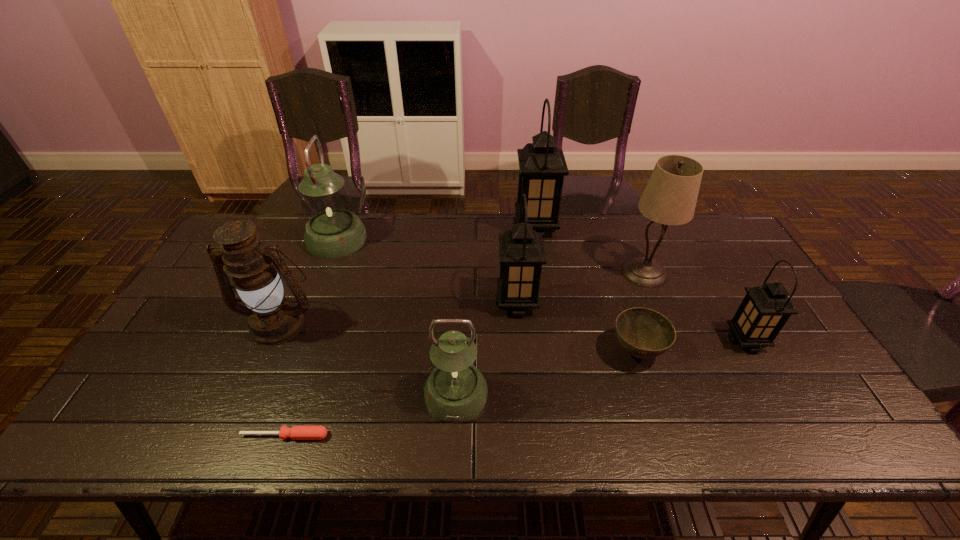
This screenshot has width=960, height=540. I want to click on free point between the second nearest lantern and the nearest object, so click(x=516, y=388).

Identify the location of vacant region between the lampshade and the fourth farthest lantern. The width and height of the screenshot is (960, 540). (695, 307).

You are a GUI agent. You are given a task and a screenshot of the screen. Output one action in this format:
    pyautogui.click(x=<x>, y=<y>)
    Task: Click on the object that is the third nearest to the rightmost black lantern
    
    Given the screenshot: What is the action you would take?
    pyautogui.click(x=521, y=251)

Choose which object is the second nearest neighbor to the farthest black lantern. Please provide its 2D coordinates. Your answer should be formatted as a tuple, i.e. [(x, y)], where the tuple contains the x and y coordinates of a point satisfying the conditions above.

[(521, 251)]

Locate which lantern ranks second in proximity to the fourth lantern from right to left. Please provide its 2D coordinates. Your answer should be formatted as a tuple, i.e. [(x, y)], where the tuple contains the x and y coordinates of a point satisfying the conditions above.

[(333, 231)]

What are the coordinates of `lantern that is the second closest to the oil lamp` in the screenshot? It's located at (456, 391).

Point out which black lantern is positioned as the third nearest to the lampshade. Please provide its 2D coordinates. Your answer should be formatted as a tuple, i.e. [(x, y)], where the tuple contains the x and y coordinates of a point satisfying the conditions above.

[(521, 251)]

Identify which black lantern is the third closest to the oil lamp. Please provide its 2D coordinates. Your answer should be formatted as a tuple, i.e. [(x, y)], where the tuple contains the x and y coordinates of a point satisfying the conditions above.

[(765, 309)]

Locate an element on the screen. The width and height of the screenshot is (960, 540). free space that satisfies the following two spatial constraints: 1. on the front side of the red screwdriver; 2. on the right side of the bigger greenish lantern is located at coordinates click(x=262, y=436).